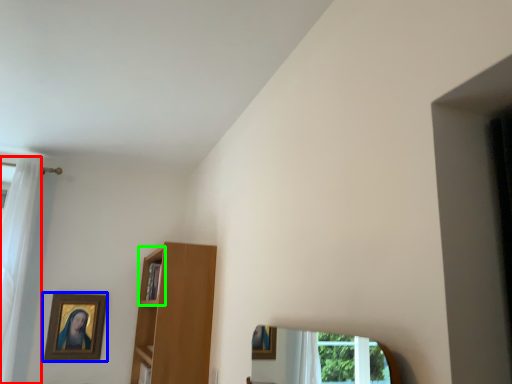
Question: Which is farther away from curtain (highlighted by a red box)? picture frame (highlighted by a blue box) or cabinet (highlighted by a green box)?

Choices:
 (A) picture frame
 (B) cabinet

Answer: (B)